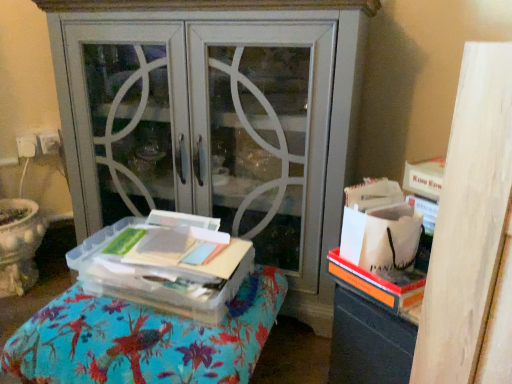
The image size is (512, 384). Find the location of `empty space that is ontop of clear plastic container at center (from a real-world perspective)`. empty space that is ontop of clear plastic container at center (from a real-world perspective) is located at coordinates (142, 310).